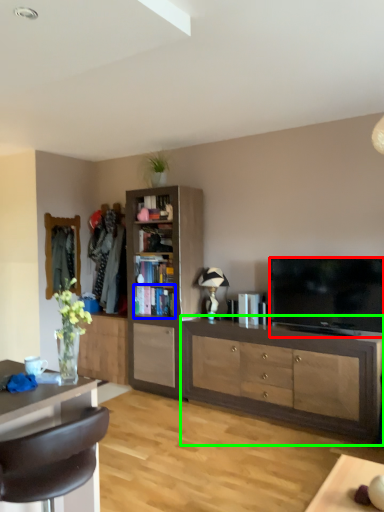
Question: Estimate the real-world distances between objects in this image. Which object is farther from television (highlighted by a red box), shelf (highlighted by a blue box) or cabinetry (highlighted by a green box)?

Choices:
 (A) shelf
 (B) cabinetry

Answer: (A)